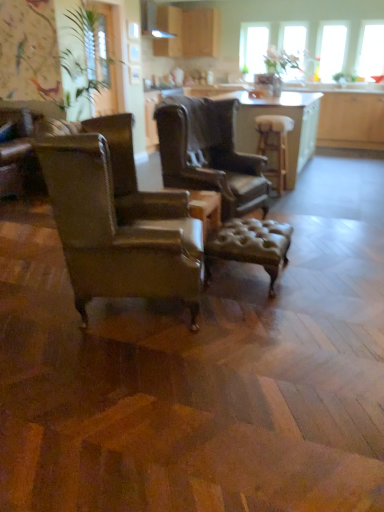
Question: Is green leafy plant at upper left far from leather armchair at left, acting as the first chair starting from the front?

Choices:
 (A) yes
 (B) no

Answer: (A)

Question: From a real-world perspective, is green leafy plant at upper left positioned under leather armchair at left, the 2th chair viewed from the back, based on gravity?

Choices:
 (A) no
 (B) yes

Answer: (A)

Question: Does green leafy plant at upper left come behind leather armchair at left, the 2th chair viewed from the back?

Choices:
 (A) no
 (B) yes

Answer: (B)

Question: From the image's perspective, is green leafy plant at upper left above leather armchair at left, acting as the first chair starting from the front?

Choices:
 (A) yes
 (B) no

Answer: (A)

Question: Is green leafy plant at upper left wider than leather armchair at left, the 2th chair viewed from the back?

Choices:
 (A) yes
 (B) no

Answer: (B)

Question: From a real-world perspective, relative to transparent glass window at upper right, positioned as the 4th window screen in left-to-right order, is leather tufted stool at center, which ranks as the first stool in front-to-back order, vertically above or below?

Choices:
 (A) below
 (B) above

Answer: (A)

Question: Is point tap(279, 254) closer or farther from the camera than point tap(365, 47)?

Choices:
 (A) farther
 (B) closer

Answer: (B)

Question: Which is correct: leather tufted stool at center, which is counted as the first stool, starting from the left, is inside transparent glass window at upper right, positioned as the 4th window screen in left-to-right order, or outside of it?

Choices:
 (A) outside
 (B) inside

Answer: (A)

Question: Visually, is leather tufted stool at center, placed as the 2th stool when sorted from right to left, positioned to the left or to the right of transparent glass window at upper right, the first window screen positioned from the right?

Choices:
 (A) right
 (B) left

Answer: (B)

Question: Looking at the image, does leather armchair at center, the 2th chair when ordered from front to back, seem bigger or smaller compared to leather armchair at left, the 2th chair viewed from the back?

Choices:
 (A) small
 (B) big

Answer: (A)

Question: Is leather armchair at center, the 2th chair when ordered from front to back, situated inside leather armchair at left, acting as the first chair starting from the front, or outside?

Choices:
 (A) outside
 (B) inside

Answer: (A)

Question: From the image's perspective, is leather armchair at center, the 1th chair in the back-to-front sequence, positioned above or below leather armchair at left, acting as the first chair starting from the front?

Choices:
 (A) above
 (B) below

Answer: (A)

Question: From a real-world perspective, is leather armchair at center, the 1th chair in the back-to-front sequence, positioned above or below leather armchair at left, acting as the first chair starting from the front?

Choices:
 (A) below
 (B) above

Answer: (B)

Question: From a real-world perspective, is leather armchair at center, the 1th chair in the back-to-front sequence, positioned above or below wooden table at center?

Choices:
 (A) below
 (B) above

Answer: (B)

Question: Choose the correct answer: Is leather armchair at center, the 1th chair in the back-to-front sequence, inside wooden table at center or outside it?

Choices:
 (A) inside
 (B) outside

Answer: (B)